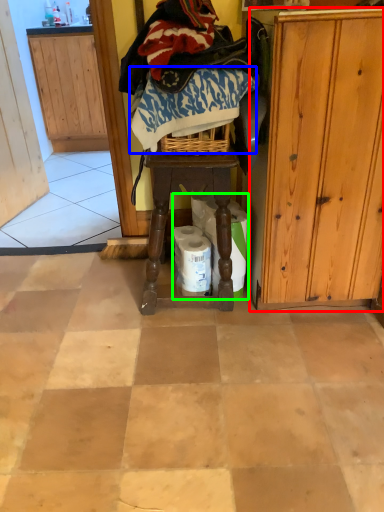
Question: Estimate the real-world distances between objects in this image. Which object is closer to cabinetry (highlighted by a red box), clothing (highlighted by a blue box) or toilet paper (highlighted by a green box)?

Choices:
 (A) clothing
 (B) toilet paper

Answer: (B)